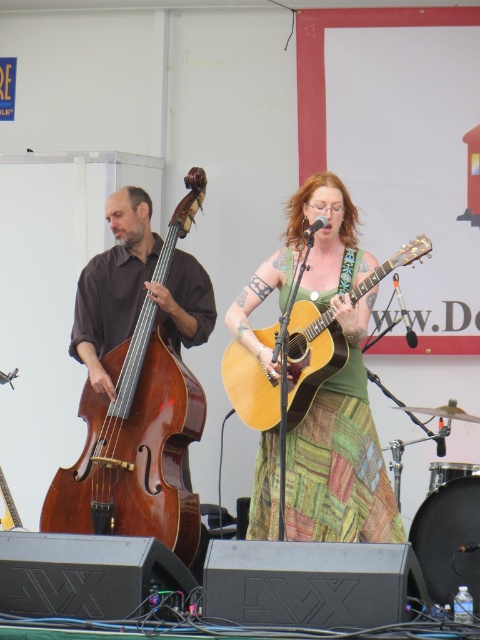
Question: Does brown matte double bass at left appear on the left side of light brown acoustic guitar at center?

Choices:
 (A) yes
 (B) no

Answer: (A)

Question: Which is farther from the brown matte double bass at left?

Choices:
 (A) brown polished wood cello at left
 (B) light brown acoustic guitar at center

Answer: (B)

Question: Does brown polished wood cello at left appear on the left side of brown matte double bass at left?

Choices:
 (A) no
 (B) yes

Answer: (B)

Question: Which point is closer to the camera?

Choices:
 (A) (226, 390)
 (B) (126, 332)

Answer: (B)

Question: Which object appears closest to the camera in this image?

Choices:
 (A) light brown acoustic guitar at center
 (B) brown matte double bass at left
 (C) brown polished wood cello at left

Answer: (A)

Question: Observing the image, what is the correct spatial positioning of brown polished wood cello at left in reference to brown matte double bass at left?

Choices:
 (A) below
 (B) above

Answer: (A)